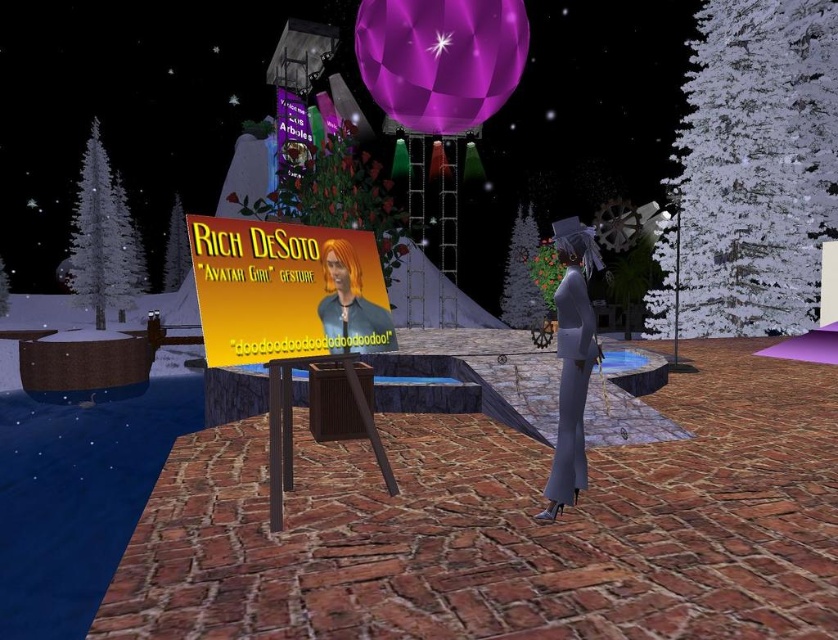
Between matte white suit at right and smooth plastic poster at center, which one is positioned lower?

matte white suit at right

Does matte white suit at right have a larger size compared to smooth plastic poster at center?

Yes.

Locate an element on the screen. The image size is (838, 640). matte white suit at right is located at coordinates (572, 362).

I want to click on matte white suit at right, so click(572, 362).